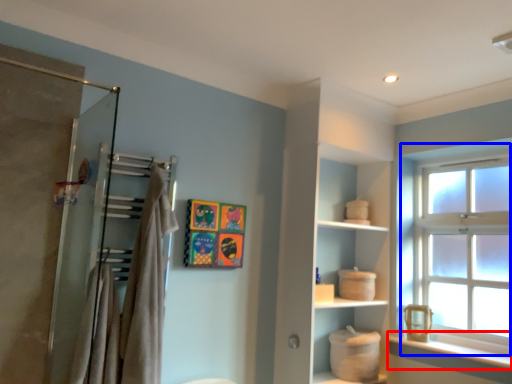
Question: Which object appears closest to the camera in this image, window sill (highlighted by a red box) or window (highlighted by a blue box)?

Choices:
 (A) window sill
 (B) window

Answer: (A)